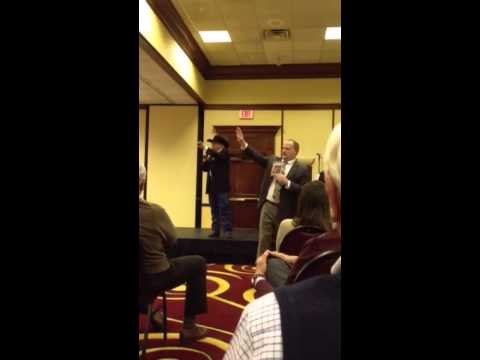
The width and height of the screenshot is (480, 360). I want to click on sign exit, so click(x=257, y=112).